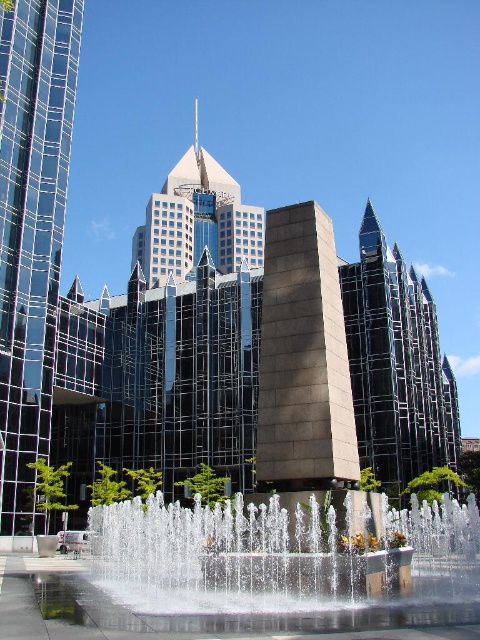
Question: Considering the relative positions of shiny glass tower at left and glassy steel skyscraper at center in the image provided, where is shiny glass tower at left located with respect to glassy steel skyscraper at center?

Choices:
 (A) left
 (B) right

Answer: (B)

Question: Is the position of slate gray stone tower at center more distant than that of glassy steel tower at center?

Choices:
 (A) no
 (B) yes

Answer: (A)

Question: Which of the following is the closest to the observer?

Choices:
 (A) (60, 236)
 (B) (408, 513)
 (C) (207, 173)

Answer: (B)

Question: Which point appears closest to the camera in this image?

Choices:
 (A) (275, 420)
 (B) (4, 380)
 (C) (361, 285)
 (D) (240, 257)

Answer: (A)

Question: Is shiny glass tower at left to the left of glassy steel skyscraper at center from the viewer's perspective?

Choices:
 (A) yes
 (B) no

Answer: (B)

Question: Which point is closer to the camera?

Choices:
 (A) (173, 202)
 (B) (391, 461)
 (C) (420, 540)

Answer: (C)